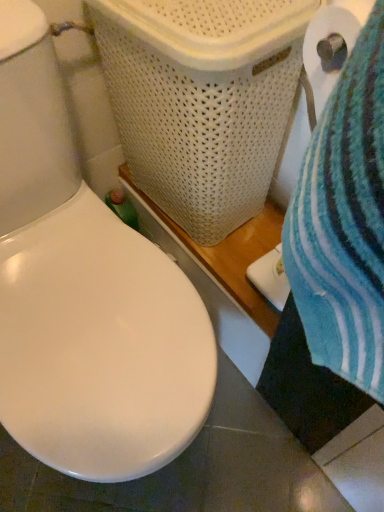
This screenshot has width=384, height=512. In order to click on white woven laundry basket at upper center in this screenshot , I will do `click(202, 100)`.

Describe the element at coordinates (202, 100) in the screenshot. I see `white woven laundry basket at upper center` at that location.

What is the approximate height of white woven laundry basket at upper center?

It is 20.69 inches.

You are a GUI agent. You are given a task and a screenshot of the screen. Output one action in this format:
    pyautogui.click(x=<x>, y=<y>)
    Task: Click on the white paper at right
    Image resolution: width=384 pixels, height=512 pixels.
    Given the screenshot: What is the action you would take?
    pyautogui.click(x=329, y=49)

This screenshot has height=512, width=384. What do you see at coordinates (329, 49) in the screenshot?
I see `white paper at right` at bounding box center [329, 49].

At what (x,y) coordinates should I click in order to perform the action: click on white woven laundry basket at upper center. Please return your answer as a coordinate pair (x, y). Looking at the image, I should click on (202, 100).

Which is more to the left, white paper at right or white woven laundry basket at upper center?

white woven laundry basket at upper center is more to the left.

Relative to white woven laundry basket at upper center, is white paper at right in front or behind?

In the image, white paper at right appears in front of white woven laundry basket at upper center.

Which is closer to the camera, (344, 6) or (242, 109)?

Positioned in front is point (344, 6).

From the image's perspective, which is above, white paper at right or white woven laundry basket at upper center?

white woven laundry basket at upper center appears higher in the image.

From a real-world perspective, who is located lower, white paper at right or white woven laundry basket at upper center?

white woven laundry basket at upper center.

Between white paper at right and white woven laundry basket at upper center, which one has smaller width?

white paper at right.

Between white paper at right and white woven laundry basket at upper center, which one has less height?

With less height is white paper at right.

In the scene shown: Between white paper at right and white woven laundry basket at upper center, which one has smaller size?

white paper at right is smaller.

Is white paper at right completely or partially outside of white woven laundry basket at upper center?

Absolutely, white paper at right is external to white woven laundry basket at upper center.

Is there a large distance between white paper at right and white woven laundry basket at upper center?

white paper at right is actually quite close to white woven laundry basket at upper center.

Is white paper at right looking in the opposite direction of white woven laundry basket at upper center?

No, white paper at right is not facing the opposite direction of white woven laundry basket at upper center.

What's the angular difference between white paper at right and white woven laundry basket at upper center's facing directions?

The angular difference between white paper at right and white woven laundry basket at upper center is 0.00099 degrees.

How much distance is there between white paper at right and white woven laundry basket at upper center?

white paper at right and white woven laundry basket at upper center are 8.03 inches apart from each other.

The height and width of the screenshot is (512, 384). In order to click on laundry basket below the white paper at right (from a real-world perspective) in this screenshot , I will do `click(202, 100)`.

Is white woven laundry basket at upper center to the left or to the right of white paper at right in the image?

white woven laundry basket at upper center is to the left of white paper at right.

Considering their positions, is white woven laundry basket at upper center located in front of or behind white paper at right?

Clearly, white woven laundry basket at upper center is behind white paper at right.

Is point (230, 82) closer to viewer compared to point (363, 19)?

That is False.

From the image's perspective, which one is positioned higher, white woven laundry basket at upper center or white paper at right?

white woven laundry basket at upper center.

Looking at this image, from a real-world perspective, is white woven laundry basket at upper center above or below white paper at right?

Clearly, from a real-world perspective, white woven laundry basket at upper center is below white paper at right.

Considering the sizes of objects white woven laundry basket at upper center and white paper at right in the image provided, who is thinner, white woven laundry basket at upper center or white paper at right?

white paper at right is thinner.

Looking at this image, who is taller, white woven laundry basket at upper center or white paper at right?

white woven laundry basket at upper center.

Considering the relative sizes of white woven laundry basket at upper center and white paper at right in the image provided, is white woven laundry basket at upper center bigger than white paper at right?

Indeed, white woven laundry basket at upper center has a larger size compared to white paper at right.

Would you say white woven laundry basket at upper center contains white paper at right?

That's incorrect, white paper at right is not inside white woven laundry basket at upper center.

Are white woven laundry basket at upper center and white paper at right beside each other?

white woven laundry basket at upper center and white paper at right are clearly separated.

Does white woven laundry basket at upper center turn towards white paper at right?

No, white woven laundry basket at upper center is not facing towards white paper at right.

How many degrees apart are the facing directions of white woven laundry basket at upper center and white paper at right?

There is a 0.00099-degree angle between the facing directions of white woven laundry basket at upper center and white paper at right.

Find the location of a particular element. toilet paper in front of the white woven laundry basket at upper center is located at coordinates point(329,49).

The width and height of the screenshot is (384, 512). Find the location of `toilet paper in front of the white woven laundry basket at upper center`. toilet paper in front of the white woven laundry basket at upper center is located at coordinates (329, 49).

Find the location of `toilet paper on the right of the white woven laundry basket at upper center`. toilet paper on the right of the white woven laundry basket at upper center is located at coordinates (329, 49).